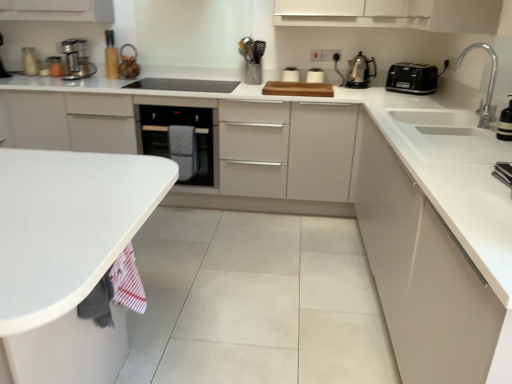
What are the coordinates of `black glass oven at center` in the screenshot? It's located at (182, 140).

What do you see at coordinates (182, 140) in the screenshot? I see `black glass oven at center` at bounding box center [182, 140].

Measure the distance between point [75,60] and camera.

3.22 meters.

Describe the element at coordinates (252, 59) in the screenshot. Image resolution: width=512 pixels, height=384 pixels. I see `matte plastic utensil holder at upper center, arranged as the second appliance when viewed from the left` at that location.

Identify the location of black glass cooktop at center, arranged as the third appliance when ordered from the bottom. (184, 85).

Describe the element at coordinates (505, 124) in the screenshot. I see `metallic silver faucet at upper right, the 2th appliance positioned from the front` at that location.

You are a GUI agent. You are given a task and a screenshot of the screen. Output one action in this format:
    pyautogui.click(x=<x>, y=<y>)
    Task: Click on the silver metallic faucet at upper right
    This screenshot has width=512, height=384.
    Given the screenshot: What is the action you would take?
    pyautogui.click(x=488, y=85)

Between metallic silver toaster at upper right, which appears as the 1th appliance when ordered from the bottom, and metallic silver faucet at upper right, arranged as the second appliance when ordered from the bottom, which one appears on the left side from the viewer's perspective?

metallic silver toaster at upper right, which appears as the 1th appliance when ordered from the bottom.

Could you measure the distance between metallic silver toaster at upper right, the sixth appliance when ordered from back to front, and metallic silver faucet at upper right, which ranks as the fifth appliance in top-to-bottom order?

The distance of metallic silver toaster at upper right, the sixth appliance when ordered from back to front, from metallic silver faucet at upper right, which ranks as the fifth appliance in top-to-bottom order, is 24.23 inches.

You are a GUI agent. You are given a task and a screenshot of the screen. Output one action in this format:
    pyautogui.click(x=<x>, y=<y>)
    Task: Click on the 1st appliance positioned above the metallic silver toaster at upper right, the 5th appliance in the left-to-right sequence (from the image's perspective)
    The image size is (512, 384).
    Given the screenshot: What is the action you would take?
    pyautogui.click(x=505, y=124)

Is metallic silver toaster at upper right, the 1th appliance viewed from the front, spatially inside metallic silver faucet at upper right, which ranks as the fifth appliance in top-to-bottom order, or outside of it?

metallic silver toaster at upper right, the 1th appliance viewed from the front, is outside metallic silver faucet at upper right, which ranks as the fifth appliance in top-to-bottom order.

Based on the photo, is matte plastic utensil holder at upper center, which is counted as the 6th appliance, starting from the bottom, not near metallic silver faucet at upper right, the 5th appliance positioned from the back?

Yes, matte plastic utensil holder at upper center, which is counted as the 6th appliance, starting from the bottom, is far from metallic silver faucet at upper right, the 5th appliance positioned from the back.

Considering the sizes of objects matte plastic utensil holder at upper center, which is counted as the 6th appliance, starting from the bottom, and metallic silver faucet at upper right, the 6th appliance positioned from the left, in the image provided, who is wider, matte plastic utensil holder at upper center, which is counted as the 6th appliance, starting from the bottom, or metallic silver faucet at upper right, the 6th appliance positioned from the left,?

Wider between the two is matte plastic utensil holder at upper center, which is counted as the 6th appliance, starting from the bottom.

Is matte plastic utensil holder at upper center, which is the fourth appliance from front to back, bigger or smaller than metallic silver faucet at upper right, the 2th appliance positioned from the front?

matte plastic utensil holder at upper center, which is the fourth appliance from front to back, is bigger than metallic silver faucet at upper right, the 2th appliance positioned from the front.

Who is smaller, white matte sink at right or metallic silver toaster at upper right, the 1th appliance viewed from the front?

metallic silver toaster at upper right, the 1th appliance viewed from the front, is smaller.

Looking at this image, considering the relative positions of white matte sink at right and metallic silver toaster at upper right, the sixth appliance when ordered from back to front, in the image provided, is white matte sink at right in front of metallic silver toaster at upper right, the sixth appliance when ordered from back to front,?

Yes, it is.

Is white matte sink at right next to metallic silver toaster at upper right, which appears as the 1th appliance when ordered from the bottom, and touching it?

No, white matte sink at right is not next to metallic silver toaster at upper right, which appears as the 1th appliance when ordered from the bottom.

From the image's perspective, does white matte sink at right appear higher than metallic silver toaster at upper right, the 1th appliance viewed from the front?

No, from the image's perspective, white matte sink at right is not over metallic silver toaster at upper right, the 1th appliance viewed from the front.

Is black glass oven at center inside the boundaries of white matte sink at right, or outside?

black glass oven at center exists outside the volume of white matte sink at right.

Based on the photo, from a real-world perspective, is black glass oven at center located beneath white matte sink at right?

Yes, from a real-world perspective, black glass oven at center is below white matte sink at right.

Looking at this image, is black glass oven at center placed right next to white matte sink at right?

No.

From a real-world perspective, is black plastic toaster at upper right, the 1th kitchen appliance when ordered from right to left, physically located above or below metallic silver toaster at upper right, the sixth appliance when ordered from back to front?

black plastic toaster at upper right, the 1th kitchen appliance when ordered from right to left, is situated higher than metallic silver toaster at upper right, the sixth appliance when ordered from back to front, in the real world.

From the image's perspective, which appliance is the 3rd one below the black plastic toaster at upper right, which is the third kitchen appliance from left to right? Please provide its 2D coordinates.

[(504, 173)]

How much distance is there between black plastic toaster at upper right, which is the third kitchen appliance from left to right, and metallic silver toaster at upper right, the 1th appliance viewed from the front?

5.34 feet.

Is metallic silver toaster at upper right, the sixth appliance from the top, situated inside silver metallic faucet at upper right or outside?

metallic silver toaster at upper right, the sixth appliance from the top, exists outside the volume of silver metallic faucet at upper right.

Based on the photo, how different are the orientations of metallic silver toaster at upper right, which appears as the 1th appliance when ordered from the bottom, and silver metallic faucet at upper right in degrees?

5.17 degrees.

Is metallic silver toaster at upper right, the sixth appliance when ordered from back to front, in front of or behind silver metallic faucet at upper right in the image?

Clearly, metallic silver toaster at upper right, the sixth appliance when ordered from back to front, is in front of silver metallic faucet at upper right.

Does metallic silver toaster at upper right, the 5th appliance in the left-to-right sequence, appear on the left side of silver metallic faucet at upper right?

Indeed, metallic silver toaster at upper right, the 5th appliance in the left-to-right sequence, is positioned on the left side of silver metallic faucet at upper right.

Is polished stainless steel kettle at upper right, placed as the second kitchen appliance when sorted from left to right, aimed at silver metallic faucet at upper right?

Yes, polished stainless steel kettle at upper right, placed as the second kitchen appliance when sorted from left to right, faces towards silver metallic faucet at upper right.

From the image's perspective, which is above, polished stainless steel kettle at upper right, which is counted as the 2th kitchen appliance, starting from the right, or silver metallic faucet at upper right?

polished stainless steel kettle at upper right, which is counted as the 2th kitchen appliance, starting from the right, is shown above in the image.

From a real-world perspective, is polished stainless steel kettle at upper right, placed as the second kitchen appliance when sorted from left to right, on top of silver metallic faucet at upper right?

No, from a real-world perspective, polished stainless steel kettle at upper right, placed as the second kitchen appliance when sorted from left to right, is not above silver metallic faucet at upper right.

The height and width of the screenshot is (384, 512). Find the location of `appliance that is the 1st one when counting backward from the metallic silver toaster at upper right, the sixth appliance from the top`. appliance that is the 1st one when counting backward from the metallic silver toaster at upper right, the sixth appliance from the top is located at coordinates (505, 124).

Find the location of a particular element. The height and width of the screenshot is (384, 512). the 2nd appliance in front of the matte plastic utensil holder at upper center, the 3th appliance positioned from the back, counting from the anchor's position is located at coordinates (505, 124).

Estimate the real-world distances between objects in this image. Which object is further from white matte countertop at lower left, matte plastic utensil holder at upper center, arranged as the second appliance when viewed from the left, or white glossy sink at right?

The object further to white matte countertop at lower left is matte plastic utensil holder at upper center, arranged as the second appliance when viewed from the left.

Considering their positions, is white glossy toaster at upper center, arranged as the fifth appliance when ordered from the bottom, positioned further to silver metallic faucet at upper right than metallic stainless steel coffee maker at left, which is counted as the first kitchen appliance, starting from the left?

metallic stainless steel coffee maker at left, which is counted as the first kitchen appliance, starting from the left, lies further to silver metallic faucet at upper right than the other object.

Based on the photo, considering their positions, is black plastic toaster at upper right, which is the third kitchen appliance from left to right, positioned closer to black glass oven at center than white matte countertop at lower left?

black plastic toaster at upper right, which is the third kitchen appliance from left to right, lies closer to black glass oven at center than the other object.

When comparing their distances from matte plastic utensil holder at upper center, the 3th appliance positioned from the back, does black glass oven at center or metallic silver faucet at upper right, the 2th appliance positioned from the front, seem further?

The object further to matte plastic utensil holder at upper center, the 3th appliance positioned from the back, is metallic silver faucet at upper right, the 2th appliance positioned from the front.

When comparing their distances from metallic stainless steel coffee maker at left, marked as the third kitchen appliance in a right-to-left arrangement, does black glass cooktop at center, which is the 4th appliance from back to front, or metallic silver toaster at upper right, the sixth appliance from the top, seem further?

Among the two, metallic silver toaster at upper right, the sixth appliance from the top, is located further to metallic stainless steel coffee maker at left, marked as the third kitchen appliance in a right-to-left arrangement.

When comparing their distances from white matte countertop at lower left, does black plastic toaster at upper right, the 1th kitchen appliance when ordered from right to left, or polished stainless steel kettle at upper right, placed as the second kitchen appliance when sorted from left to right, seem closer?

black plastic toaster at upper right, the 1th kitchen appliance when ordered from right to left, is closer to white matte countertop at lower left.

Which object lies further to the anchor point metallic silver toaster at upper right, the sixth appliance from the top, white glossy toaster at upper center, which is the sixth appliance in front-to-back order, or white matte sink at right?

Among the two, white glossy toaster at upper center, which is the sixth appliance in front-to-back order, is located further to metallic silver toaster at upper right, the sixth appliance from the top.

Looking at the image, which one is located closer to matte plastic utensil holder at upper center, which is counted as the 6th appliance, starting from the bottom, metallic silver faucet at upper right, the 6th appliance positioned from the left, or black glass oven at center?

black glass oven at center is positioned closer to the anchor matte plastic utensil holder at upper center, which is counted as the 6th appliance, starting from the bottom.

What are the coordinates of `home appliance between white glossy sink at right and matte plastic utensil holder at upper center, the 3th appliance positioned from the back, from front to back` in the screenshot? It's located at (182, 140).

I want to click on kitchen appliance between metallic stainless steel coffee maker at left, which is counted as the first kitchen appliance, starting from the left, and silver metallic faucet at upper right from left to right, so click(359, 72).

Image resolution: width=512 pixels, height=384 pixels. What are the coordinates of `sink between white matte sink at right and black glass oven at center from front to back` in the screenshot? It's located at (451, 136).

You are a GUI agent. You are given a task and a screenshot of the screen. Output one action in this format:
    pyautogui.click(x=<x>, y=<y>)
    Task: Click on the home appliance situated between metallic stainless steel coffee maker at left, which is counted as the first kitchen appliance, starting from the left, and black glass cooktop at center, acting as the 1th appliance starting from the left, from left to right
    This screenshot has height=384, width=512.
    Given the screenshot: What is the action you would take?
    pyautogui.click(x=182, y=140)